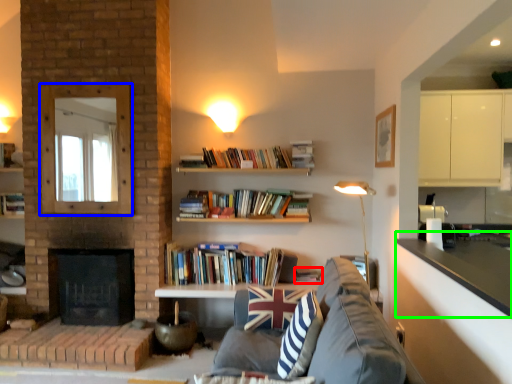
Question: Which is farther away from book (highlighted by a red box)? mirror (highlighted by a blue box) or counter top (highlighted by a green box)?

Choices:
 (A) mirror
 (B) counter top

Answer: (A)